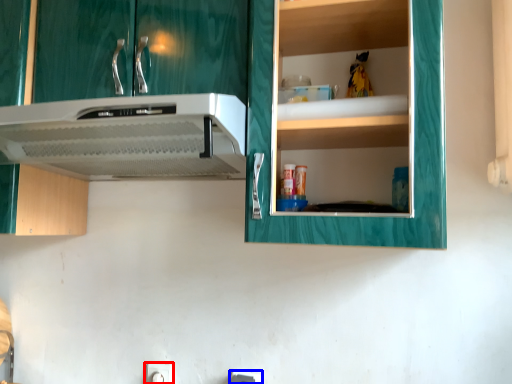
Question: Which of the following is the closest to the observer, electric outlet (highlighted by a red box) or electric outlet (highlighted by a blue box)?

Choices:
 (A) electric outlet
 (B) electric outlet

Answer: (B)